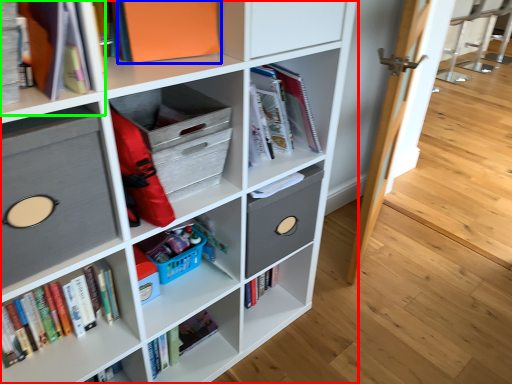
Question: Considering the real-world distances, which object is farthest from shelf (highlighted by a red box)? paperback book (highlighted by a blue box) or shelf (highlighted by a green box)?

Choices:
 (A) paperback book
 (B) shelf

Answer: (B)